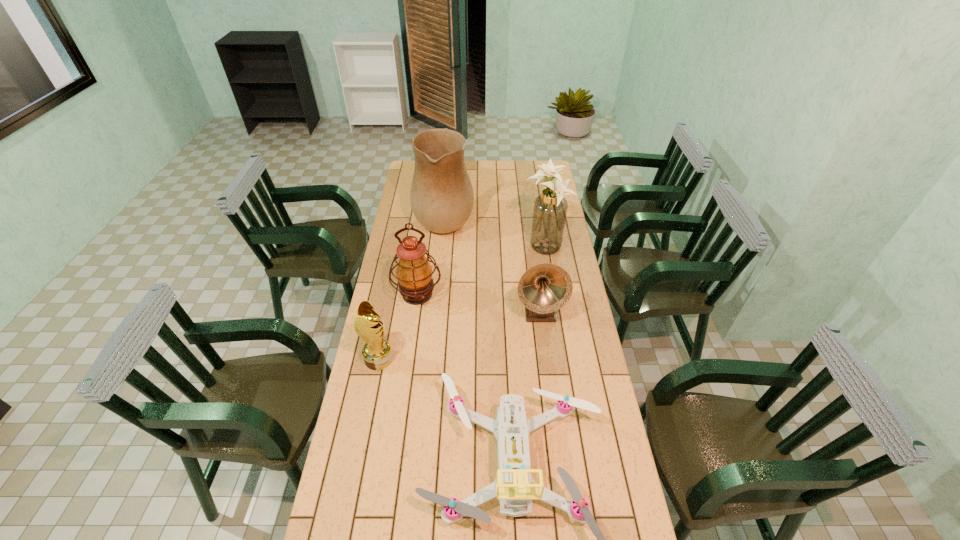
This screenshot has height=540, width=960. I want to click on cream pitcher that is at the left edge, so click(441, 196).

Identify the location of oil lamp that is at the left edge. The height and width of the screenshot is (540, 960). (414, 273).

This screenshot has width=960, height=540. Identify the location of award that is positioned at the left edge. (377, 353).

Identify the location of flower arrangement located at the right edge. Image resolution: width=960 pixels, height=540 pixels. (550, 208).

Locate an element on the screen. Image resolution: width=960 pixels, height=540 pixels. phonograph record at the right edge is located at coordinates (543, 289).

Identify the location of vacant region at the left edge of the desktop. (367, 495).

In the image, there is a desktop. What are the coordinates of `vacant space at the right edge` in the screenshot? It's located at (579, 458).

Identify the location of free space between the cream pitcher and the phonograph record. (492, 264).

Locate an element on the screen. This screenshot has height=540, width=960. free space between the cream pitcher and the flower arrangement is located at coordinates (494, 232).

This screenshot has width=960, height=540. Identify the location of free space between the oil lamp and the flower arrangement. (481, 271).